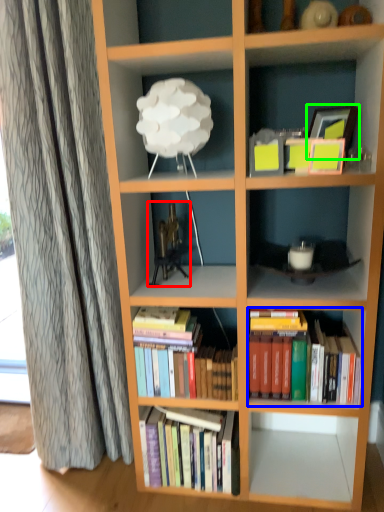
Question: Estimate the real-world distances between objects in this image. Which object is closer to toy (highlighted by a red box), book (highlighted by a blue box) or picture frame (highlighted by a green box)?

Choices:
 (A) book
 (B) picture frame

Answer: (A)